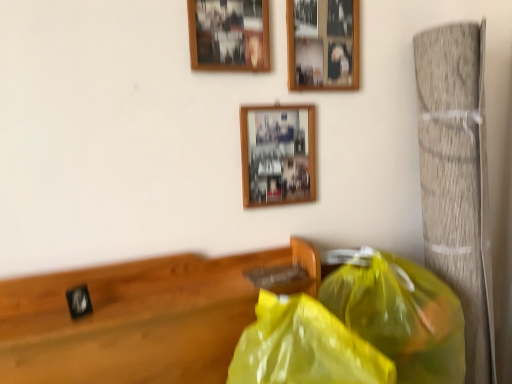
Question: From a real-world perspective, is yellow translucent plastic bag at lower right, which is counted as the 2th plastic bag, starting from the right, above or below wooden picture frame at upper center, the first picture frame in the top-to-bottom sequence?

Choices:
 (A) above
 (B) below

Answer: (B)

Question: In terms of width, does yellow translucent plastic bag at lower right, which is counted as the 2th plastic bag, starting from the right, look wider or thinner when compared to wooden picture frame at upper center, the third picture frame from the bottom?

Choices:
 (A) wide
 (B) thin

Answer: (A)

Question: Estimate the real-world distances between objects in this image. Which object is farther from the wooden picture frame at center, the 1th picture frame positioned from the bottom?

Choices:
 (A) black matte clock at left
 (B) wooden photo frame at upper center, placed as the 2th picture frame when sorted from top to bottom
 (C) yellow translucent plastic bag at right, which is the first plastic bag from right to left
 (D) yellow translucent plastic bag at lower right, placed as the 1th plastic bag when sorted from left to right
 (E) wooden picture frame at upper center, the first picture frame in the top-to-bottom sequence

Answer: (D)

Question: Which object is the closest to the black matte clock at left?

Choices:
 (A) wooden picture frame at upper center, the third picture frame from the bottom
 (B) wooden picture frame at center, which is the third picture frame from top to bottom
 (C) wooden photo frame at upper center, placed as the second picture frame when sorted from bottom to top
 (D) yellow translucent plastic bag at lower right, which is counted as the 2th plastic bag, starting from the right
 (E) yellow translucent plastic bag at right, which is the second plastic bag in left-to-right order

Answer: (D)